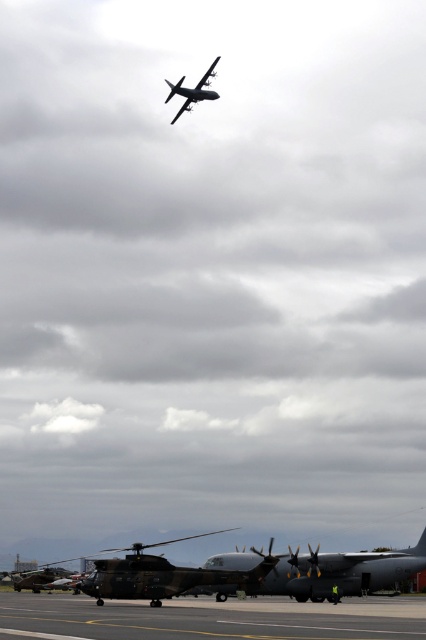
You are standing at the point marked by the coordinate point at (166, 576). What object are you standing on?

You are standing on the camouflage paint helicopter at lower center.

You are a pilot on the airfield. You need to taxi your airplane to the runway. There is a camouflage paint helicopter at lower center and a metallic gray airplane at upper center in your way. Which object is closer to the left side of your path?

The camouflage paint helicopter at lower center is to the left of the metallic gray airplane at upper center, so it is closer to the left side of your path.

You are a pilot preparing to board the metallic gray airplane at upper center. From your current position on the concrete tarmac at lower center, which direction should you walk to reach the airplane?

The concrete tarmac at lower center is in front of the metallic gray airplane at upper center, so you should walk backward to reach the airplane.